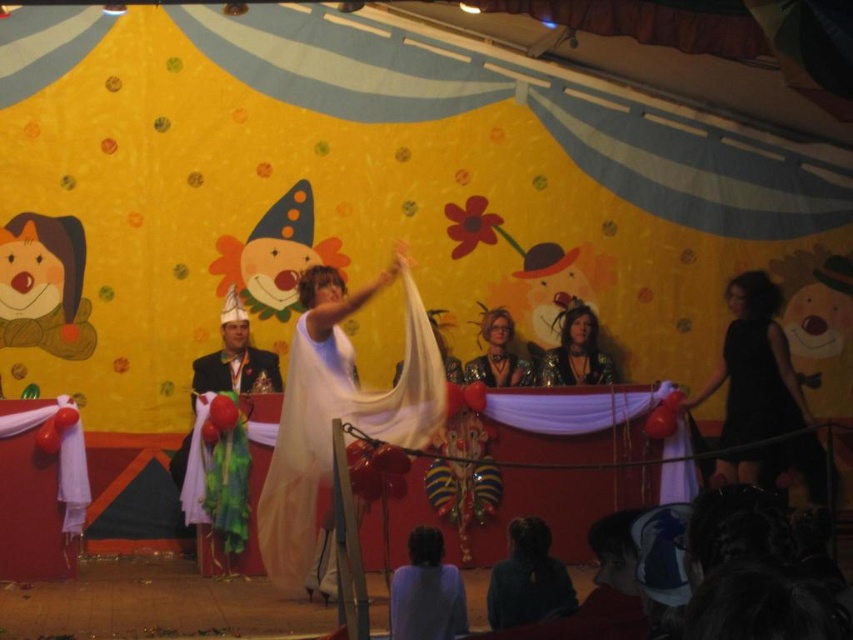
You are standing at the center of the stage in the carnival scene. You need to locate the purple fabric at lower center. According to the coordinates provided, where exactly is it positioned?

The purple fabric at lower center is positioned at coordinates point (426,592).

You are a participant in the carnival game and need to choose between the purple fabric at lower center and the shiny silver hat at left to cover a large box. Which object has a smaller width and would be less suitable for covering the box?

The purple fabric at lower center has a lesser width compared to the shiny silver hat at left, making it less suitable for covering the large box.

You are a guest at the carnival and notice two items in the scene. The first is the dark fabric at lower center, and the second is the shiny metallic necklace at center. Which of these two items is taller?

The shiny metallic necklace at center is taller than the dark fabric at lower center.